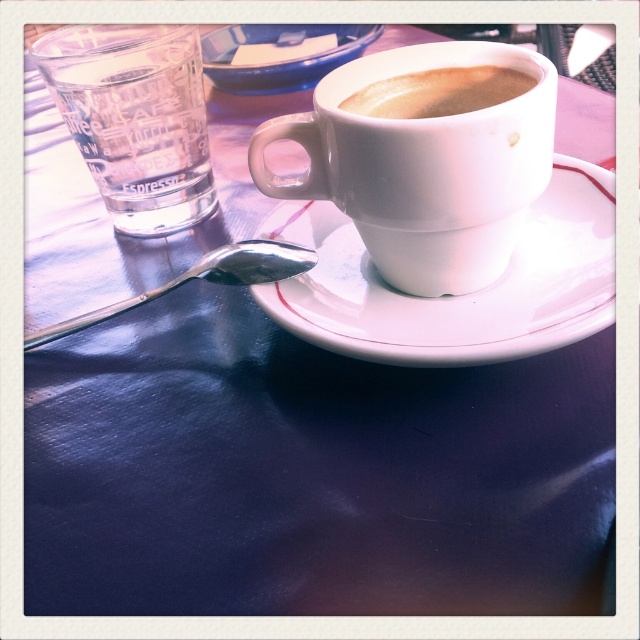
Is white matte cup at center above white ceramic saucer at center?

Indeed, white matte cup at center is positioned over white ceramic saucer at center.

Consider the image. Does white matte cup at center have a lesser height compared to white ceramic saucer at center?

No, white matte cup at center is not shorter than white ceramic saucer at center.

Identify the location of white matte cup at center. The width and height of the screenshot is (640, 640). (422, 166).

Is white ceramic saucer at center wider than transparent glass at left?

Yes, white ceramic saucer at center is wider than transparent glass at left.

Who is higher up, white ceramic saucer at center or transparent glass at left?

Positioned higher is transparent glass at left.

Measure the distance between white ceramic saucer at center and camera.

white ceramic saucer at center and camera are 8.10 inches apart.

Where is `white ceramic saucer at center`? white ceramic saucer at center is located at coordinates (460, 296).

What do you see at coordinates (134, 118) in the screenshot? I see `transparent glass at left` at bounding box center [134, 118].

Which is below, transparent glass at left or matte ceramic cup at upper center?

matte ceramic cup at upper center is below.

Who is more forward, (177, 164) or (388, 93)?

Point (388, 93) is more forward.

Find the location of a particular element. The height and width of the screenshot is (640, 640). transparent glass at left is located at coordinates (134, 118).